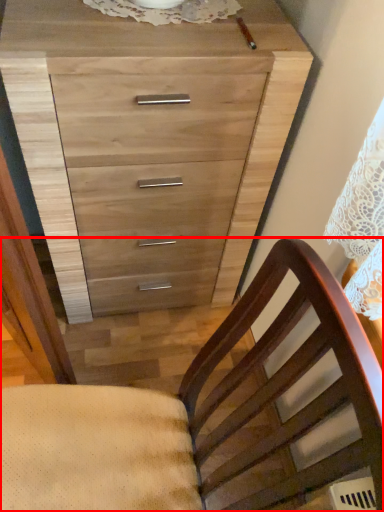
Question: From the image's perspective, what is the correct spatial positioning of chair (annotated by the red box) in reference to chest of drawers?

Choices:
 (A) below
 (B) above

Answer: (A)